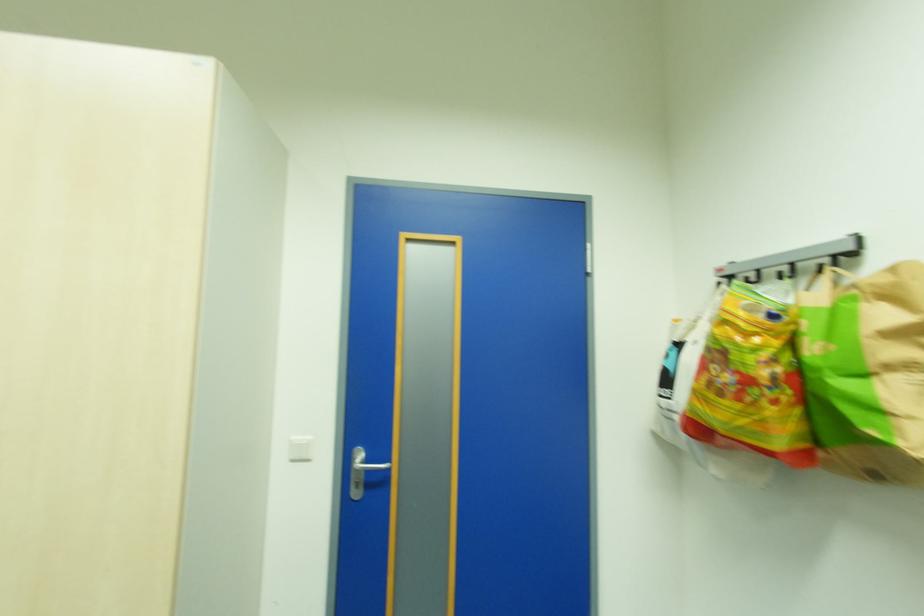
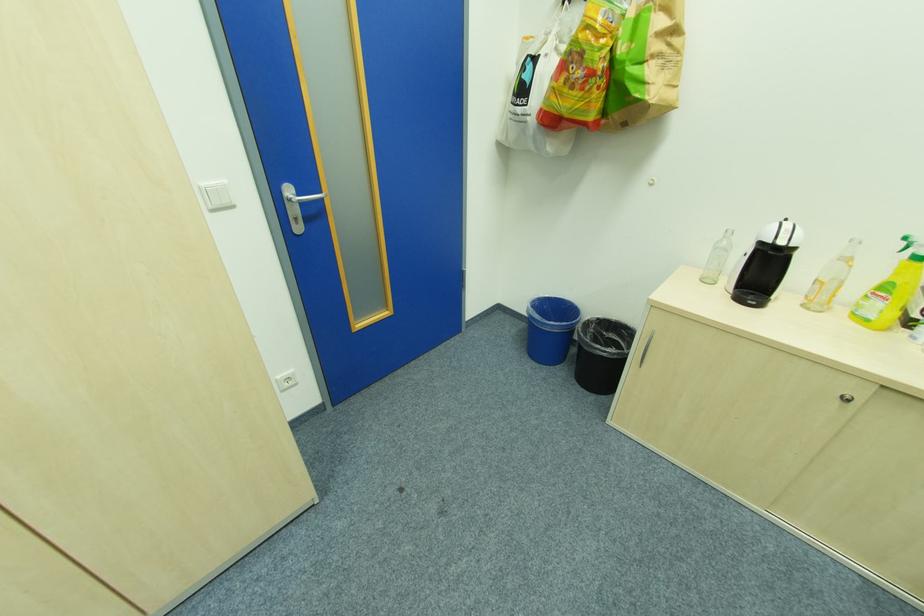
Locate, in the second image, the point that corresponds to the point at 307,459 in the first image.

(232, 204)